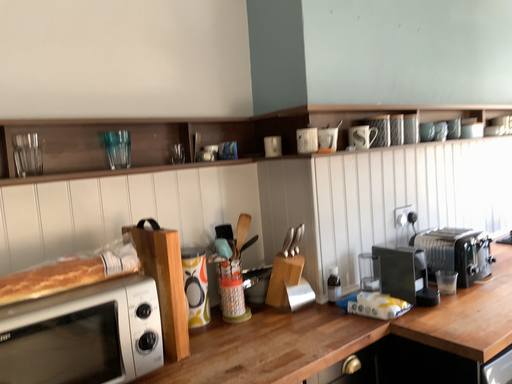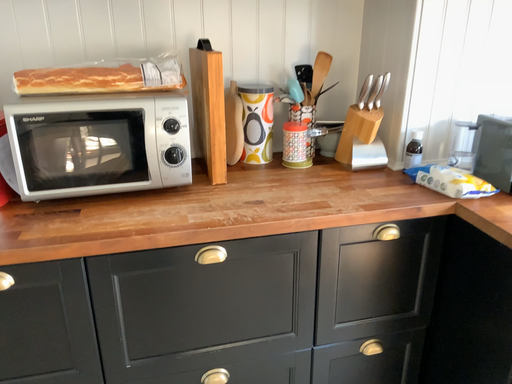
Question: Which way did the camera rotate in the video?

Choices:
 (A) rotated left
 (B) rotated right

Answer: (A)